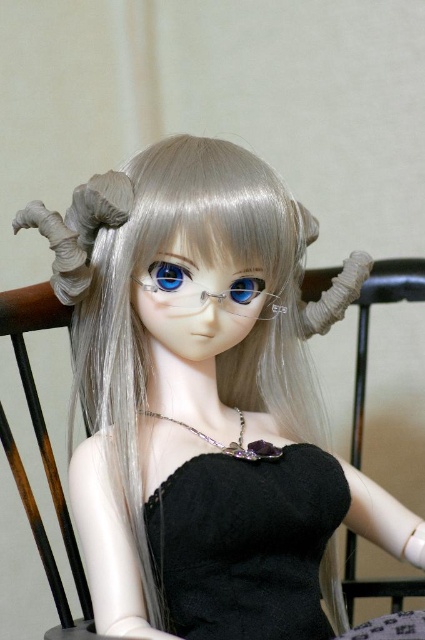
Is black velvet dress at center closer to the viewer compared to blue glass eye at center?

Yes, it is.

Is point (266, 481) positioned behind point (238, 276)?

Yes, it is behind point (238, 276).

Where is `black velvet dress at center`? black velvet dress at center is located at coordinates (246, 544).

Consider the image. Who is positioned more to the right, blue glossy eye at center or blue glass eye at center?

Positioned to the right is blue glass eye at center.

Who is more distant from viewer, (152, 289) or (255, 296)?

Positioned behind is point (255, 296).

Identify the location of blue glossy eye at center. Image resolution: width=425 pixels, height=640 pixels. (169, 276).

Where is `blue glossy eye at center`? This screenshot has height=640, width=425. blue glossy eye at center is located at coordinates (169, 276).

Is black velvet dress at center to the right of blue glossy eye at center from the viewer's perspective?

Yes, black velvet dress at center is to the right of blue glossy eye at center.

Can you confirm if black velvet dress at center is shorter than blue glossy eye at center?

No, black velvet dress at center is not shorter than blue glossy eye at center.

Is point (265, 557) less distant than point (186, 273)?

No, it is not.

Locate an element on the screen. This screenshot has height=640, width=425. black velvet dress at center is located at coordinates (246, 544).